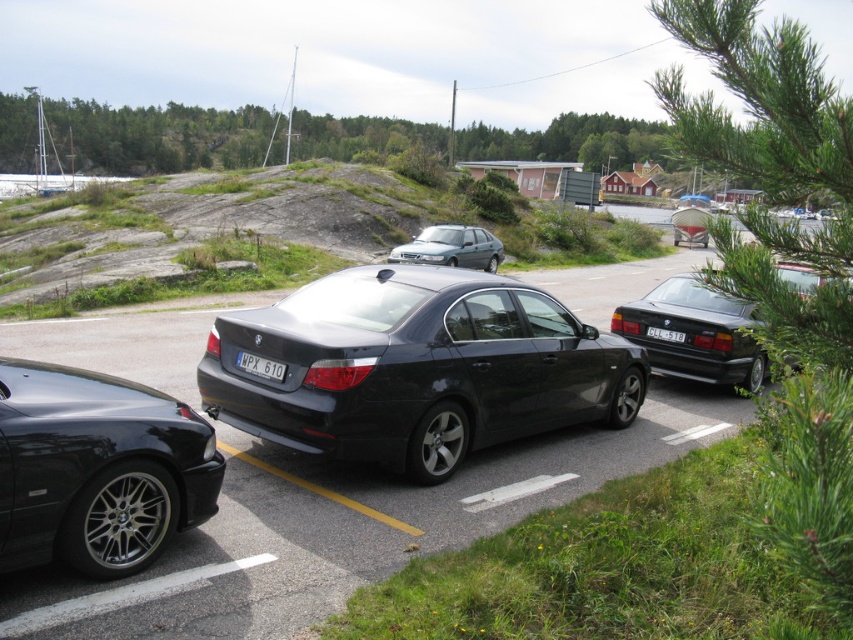
You are a parking attendant who needs to fit a new car into the parking spot between the glossy black sedan at right and the black plastic license plate at center. The new car requires a height clearance of 2 meters. Can you confirm if the space between them is tall enough?

The glossy black sedan at right is taller than the black plastic license plate at center. However, since the height of the glossy black sedan at right isn